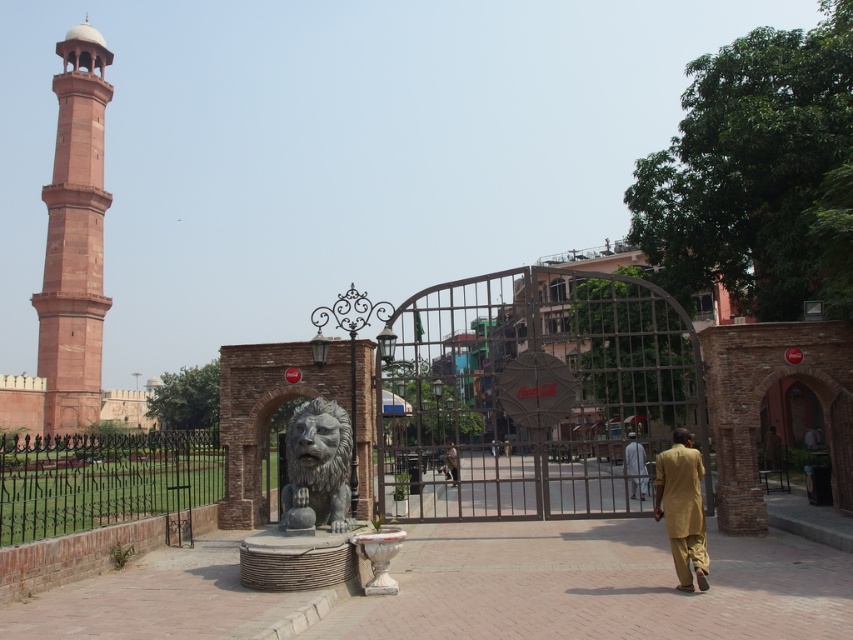
Question: Which point appears closest to the camera in this image?

Choices:
 (A) (35, 484)
 (B) (57, 330)
 (C) (316, 456)
 (D) (680, 449)

Answer: (D)

Question: Estimate the real-world distances between objects in this image. Which object is closer to the black wrought iron fence at lower left?

Choices:
 (A) light brown cotton shirt at lower right
 (B) light brown fabric shirt at center

Answer: (B)

Question: Does bronze lion statue at center appear on the right side of light brown fabric shirt at center?

Choices:
 (A) yes
 (B) no

Answer: (B)

Question: Which point is farther from the camera taking this photo?

Choices:
 (A) (630, 438)
 (B) (155, 493)
 (C) (699, 547)

Answer: (A)

Question: Is reddish sandstone minaret at left positioned behind black wrought iron fence at lower left?

Choices:
 (A) no
 (B) yes

Answer: (B)

Question: Is bronze lion statue at center further to the viewer compared to light brown fabric shirt at center?

Choices:
 (A) no
 (B) yes

Answer: (A)